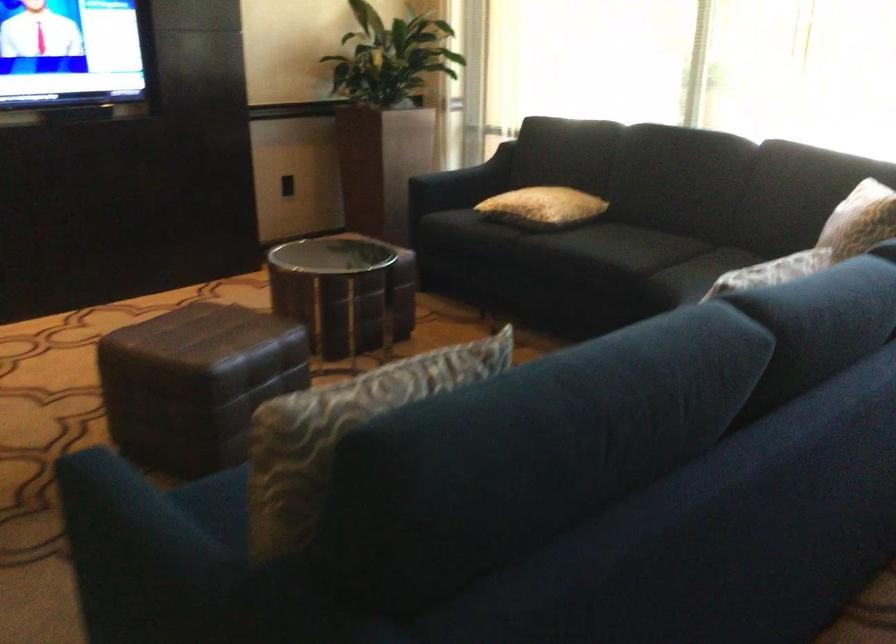
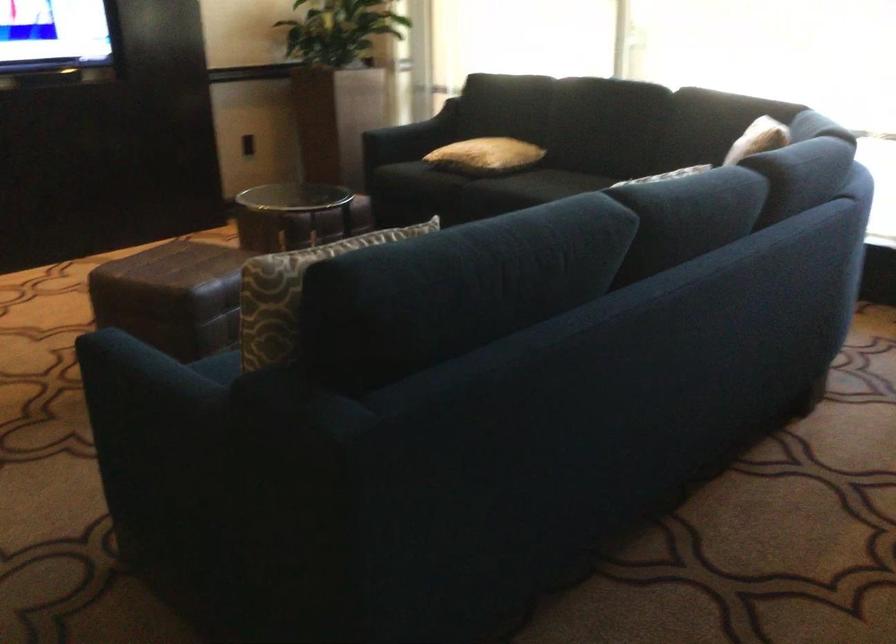
Question: The images are taken continuously from a first-person perspective. In which direction is your viewpoint rotating?

Choices:
 (A) Left
 (B) Right
 (C) Up
 (D) Down

Answer: (B)